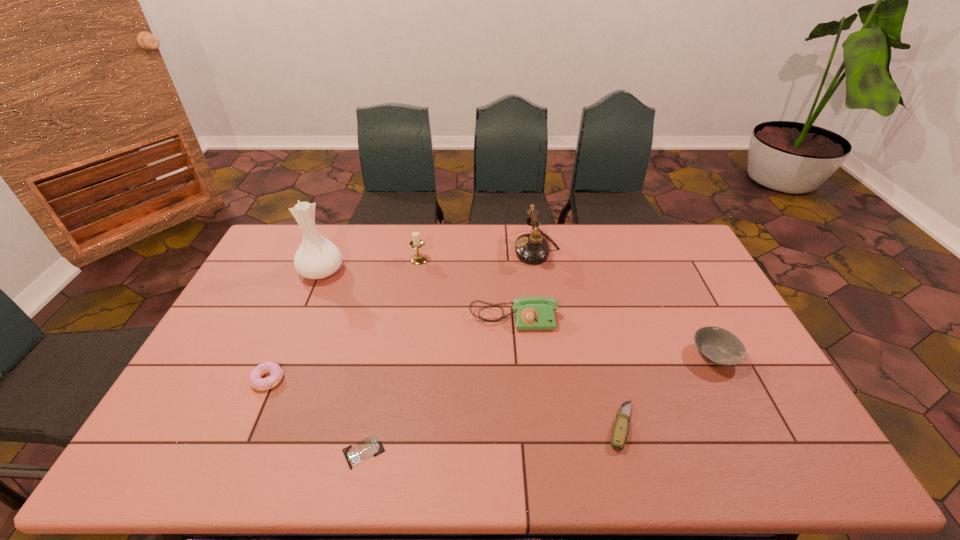
I want to click on vase, so pos(317,258).

Where is `the seventh shortest object`? the seventh shortest object is located at coordinates (532, 248).

The image size is (960, 540). In order to click on the farther telephone in this screenshot , I will do `click(532, 248)`.

I want to click on candle holder, so click(416, 243).

Locate an element on the screen. The height and width of the screenshot is (540, 960). the fifth nearest object is located at coordinates (531, 313).

Identify the location of the shorter telephone. (531, 313).

Find the location of a particular element. This screenshot has width=960, height=540. bowl is located at coordinates (718, 346).

Identify the location of the rightmost object. (718, 346).

The width and height of the screenshot is (960, 540). Find the location of `the sixth tallest object`. the sixth tallest object is located at coordinates (257, 382).

Locate an element on the screen. The image size is (960, 540). the second object from right to left is located at coordinates (619, 435).